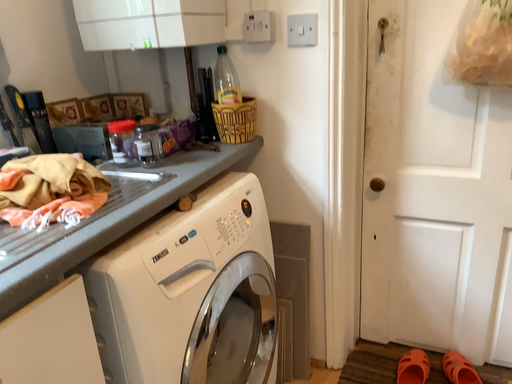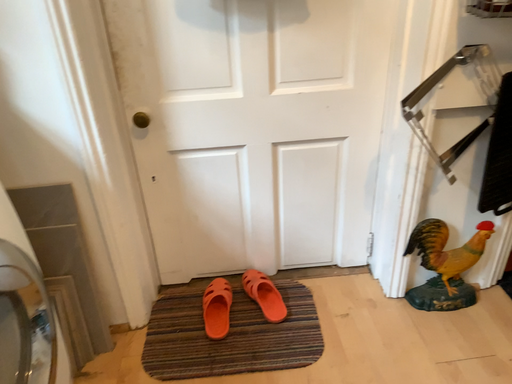
Question: Which way did the camera rotate in the video?

Choices:
 (A) rotated left
 (B) rotated right

Answer: (B)